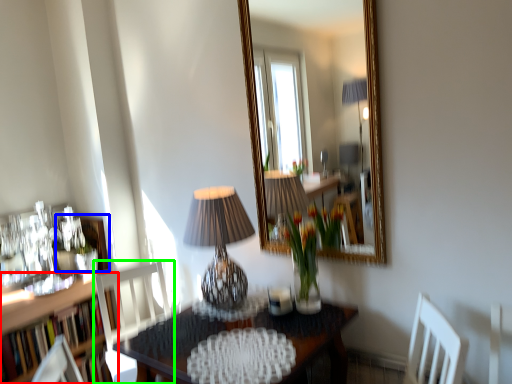
Question: Which object is the closest to the bookcase (highlighted by a red box)? Choose among these: picture frame (highlighted by a blue box) or chair (highlighted by a green box).

Choices:
 (A) picture frame
 (B) chair

Answer: (B)